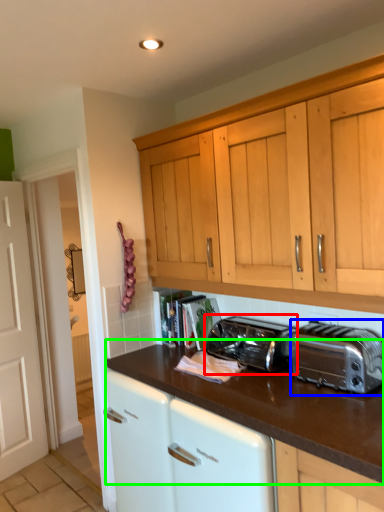
Question: Which object is the closest to the toaster (highlighted by a red box)? Choose among these: toaster (highlighted by a blue box) or countertop (highlighted by a green box).

Choices:
 (A) toaster
 (B) countertop

Answer: (B)